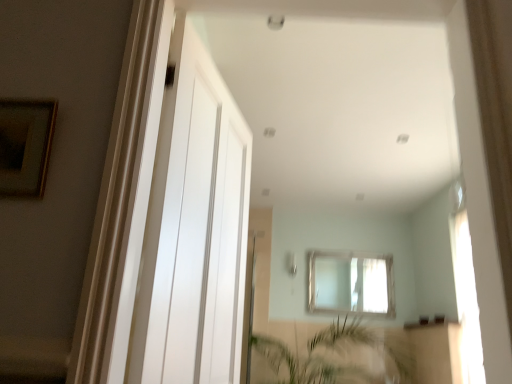
Question: From a real-world perspective, is black glass window sill at lower center physically above clear glass window at center?

Choices:
 (A) yes
 (B) no

Answer: (B)

Question: Does black glass window sill at lower center come behind clear glass window at center?

Choices:
 (A) no
 (B) yes

Answer: (A)

Question: From a real-world perspective, is black glass window sill at lower center physically below clear glass window at center?

Choices:
 (A) no
 (B) yes

Answer: (B)

Question: Is black glass window sill at lower center not inside clear glass window at center?

Choices:
 (A) no
 (B) yes

Answer: (B)

Question: Would you say clear glass window at center is part of black glass window sill at lower center's contents?

Choices:
 (A) yes
 (B) no

Answer: (B)

Question: Is point (423, 326) positioned closer to the camera than point (373, 332)?

Choices:
 (A) farther
 (B) closer

Answer: (B)

Question: Looking at their shapes, would you say black glass window sill at lower center is wider or thinner than green leafy plant at lower center?

Choices:
 (A) thin
 (B) wide

Answer: (A)

Question: From the image's perspective, relative to green leafy plant at lower center, is black glass window sill at lower center above or below?

Choices:
 (A) above
 (B) below

Answer: (A)

Question: From a real-world perspective, is black glass window sill at lower center positioned above or below green leafy plant at lower center?

Choices:
 (A) below
 (B) above

Answer: (B)

Question: Which is correct: white glossy door at center is inside green leafy plant at lower center, or outside of it?

Choices:
 (A) inside
 (B) outside

Answer: (B)

Question: From their relative heights in the image, would you say white glossy door at center is taller or shorter than green leafy plant at lower center?

Choices:
 (A) short
 (B) tall

Answer: (B)

Question: From the image's perspective, is white glossy door at center positioned above or below green leafy plant at lower center?

Choices:
 (A) below
 (B) above

Answer: (B)

Question: Is white glossy door at center bigger or smaller than green leafy plant at lower center?

Choices:
 (A) big
 (B) small

Answer: (B)

Question: In terms of size, does green leafy plant at lower center appear bigger or smaller than white glossy door at center?

Choices:
 (A) big
 (B) small

Answer: (A)

Question: From the image's perspective, is green leafy plant at lower center located above or below white glossy door at center?

Choices:
 (A) above
 (B) below

Answer: (B)